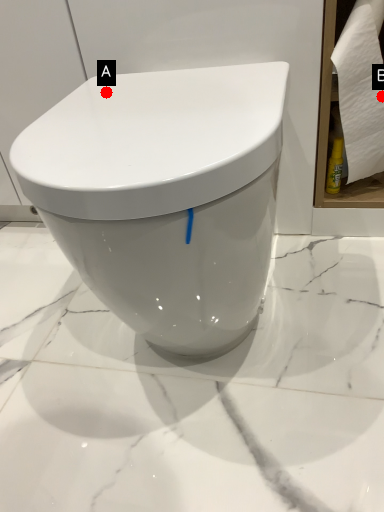
Question: Two points are circled on the image, labeled by A and B beside each circle. Which point is closer to the camera?

Choices:
 (A) A is closer
 (B) B is closer

Answer: (A)